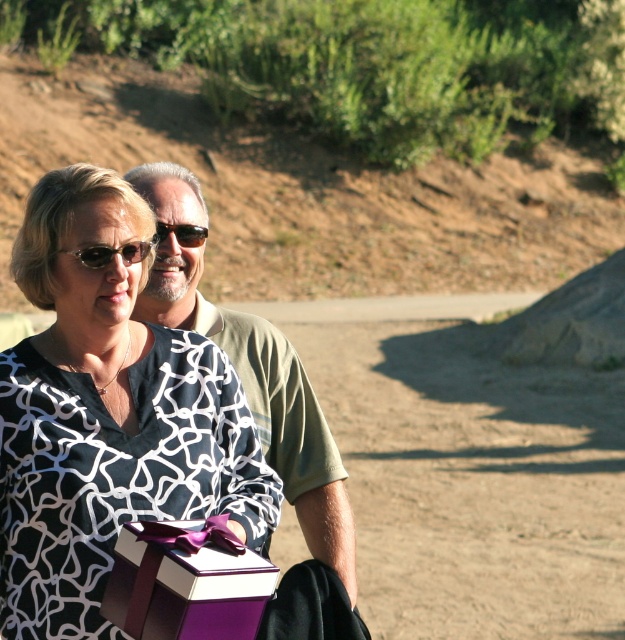
Is point (222, 337) farther from camera compared to point (96, 252)?

That is True.

This screenshot has width=625, height=640. Describe the element at coordinates (276, 445) in the screenshot. I see `green matte shirt at center` at that location.

Image resolution: width=625 pixels, height=640 pixels. I want to click on green matte shirt at center, so click(276, 445).

Is green matte shirt at center thinner than brown matte sunglasses at center?

No, green matte shirt at center is not thinner than brown matte sunglasses at center.

Between green matte shirt at center and brown matte sunglasses at center, which one appears on the left side from the viewer's perspective?

Positioned to the left is brown matte sunglasses at center.

The height and width of the screenshot is (640, 625). Describe the element at coordinates (276, 445) in the screenshot. I see `green matte shirt at center` at that location.

Locate an element on the screen. green matte shirt at center is located at coordinates (276, 445).

Does green matte shirt at center come behind purple matte gift box at lower center?

That is True.

Is green matte shirt at center to the right of purple matte gift box at lower center from the viewer's perspective?

Indeed, green matte shirt at center is positioned on the right side of purple matte gift box at lower center.

What do you see at coordinates (276, 445) in the screenshot?
I see `green matte shirt at center` at bounding box center [276, 445].

Where is `green matte shirt at center`? The height and width of the screenshot is (640, 625). green matte shirt at center is located at coordinates (276, 445).